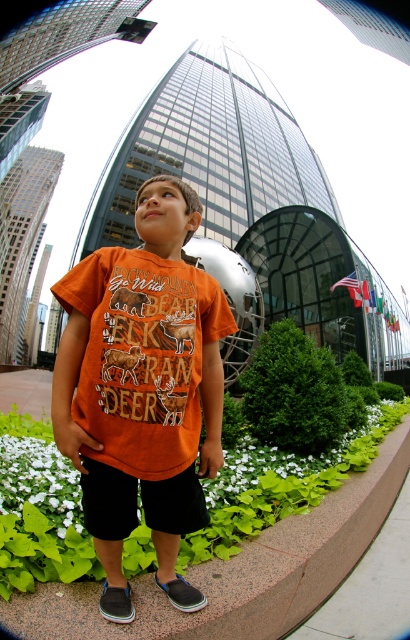
Question: Considering the real-world distances, which object is farthest from the orange cotton shirt at center?

Choices:
 (A) black cotton shorts at center
 (B) granite ledge at lower center

Answer: (B)

Question: In this image, where is granite ledge at lower center located relative to black cotton shorts at center?

Choices:
 (A) right
 (B) left

Answer: (A)

Question: Among these objects, which one is farthest from the camera?

Choices:
 (A) black cotton shorts at center
 (B) granite ledge at lower center
 (C) orange cotton shirt at center

Answer: (B)

Question: Considering the relative positions of granite ledge at lower center and black cotton shorts at center in the image provided, where is granite ledge at lower center located with respect to black cotton shorts at center?

Choices:
 (A) right
 (B) left

Answer: (A)

Question: Is granite ledge at lower center positioned behind black cotton shorts at center?

Choices:
 (A) no
 (B) yes

Answer: (B)

Question: Which object is positioned closest to the black cotton shorts at center?

Choices:
 (A) orange cotton shirt at center
 (B) granite ledge at lower center

Answer: (A)